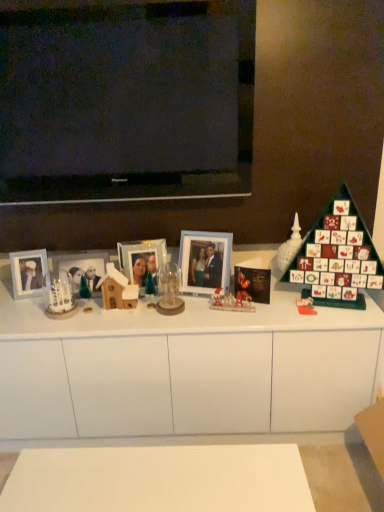
You are a GUI agent. You are given a task and a screenshot of the screen. Output one action in this format:
    pyautogui.click(x=<x>, y=<y>)
    Task: Click on the vacant area that is in front of wooden house at center, the first toy from the left
    The height and width of the screenshot is (512, 384).
    Given the screenshot: What is the action you would take?
    pyautogui.click(x=114, y=321)